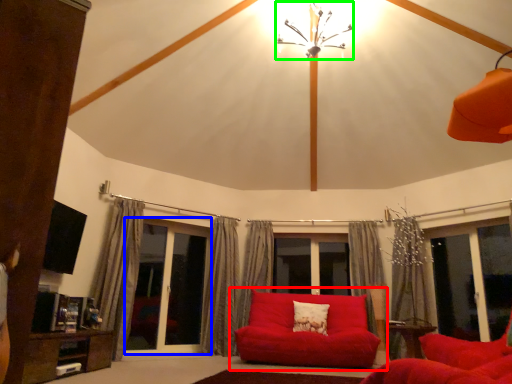
Question: Based on their relative distances, which object is farther from studio couch (highlighted by a red box)? Choose from screen door (highlighted by a blue box) and light fixture (highlighted by a green box).

Choices:
 (A) screen door
 (B) light fixture

Answer: (B)